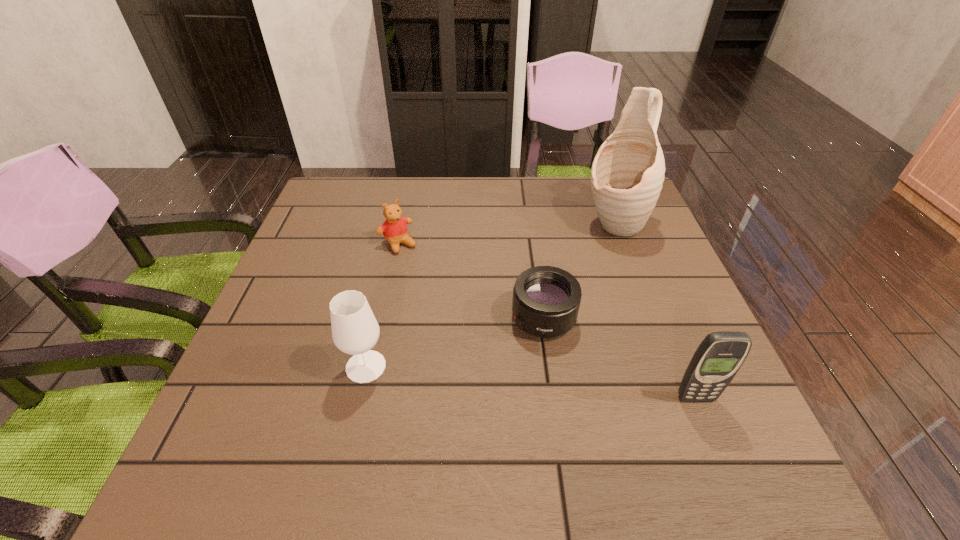
Find the location of a particular element. Image resolution: width=960 pixels, height=540 pixels. free space on the desktop that is between the fourth farthest object and the nearest object and is positioned at the spout of the pitcher is located at coordinates (495, 379).

This screenshot has width=960, height=540. I want to click on vacant space on the desktop that is between the glass and the nearest object and is positioned on the side of the telephoto lens with brand markings and control switches, so click(477, 377).

This screenshot has width=960, height=540. What are the coordinates of `vacant space on the desktop that is between the glass and the cellular telephone and is positioned on the front-facing side of the teddy bear` in the screenshot? It's located at (509, 380).